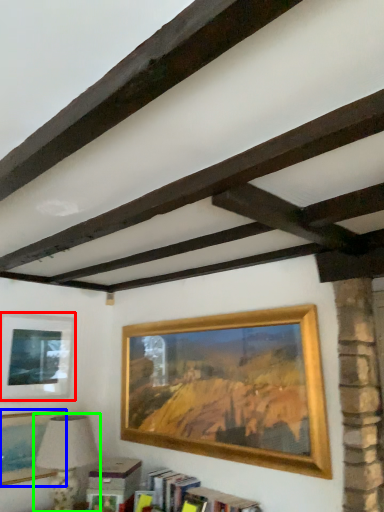
Question: Which object is positioned farthest from picture frame (highlighted by a red box)? Select from picture frame (highlighted by a blue box) and table lamp (highlighted by a green box).

Choices:
 (A) picture frame
 (B) table lamp

Answer: (B)